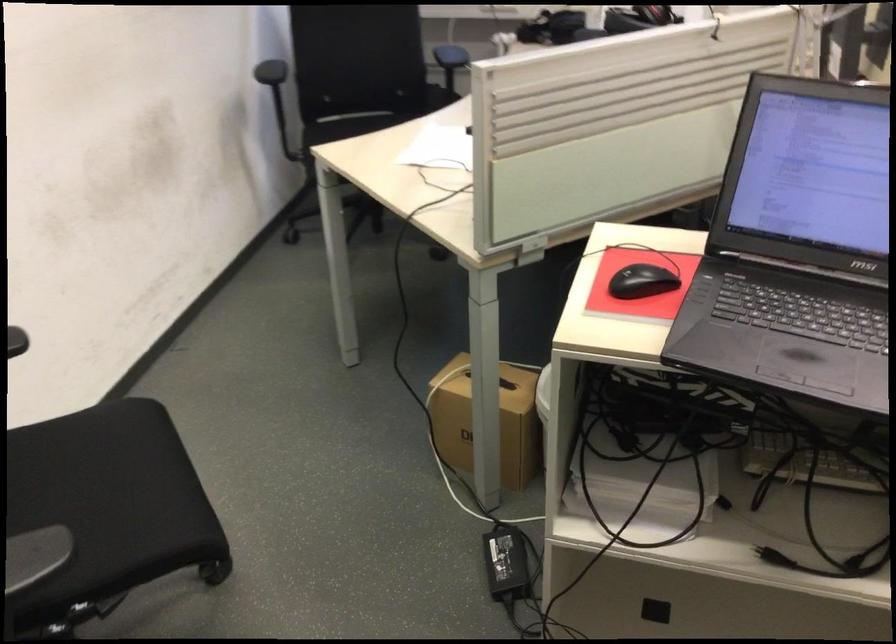
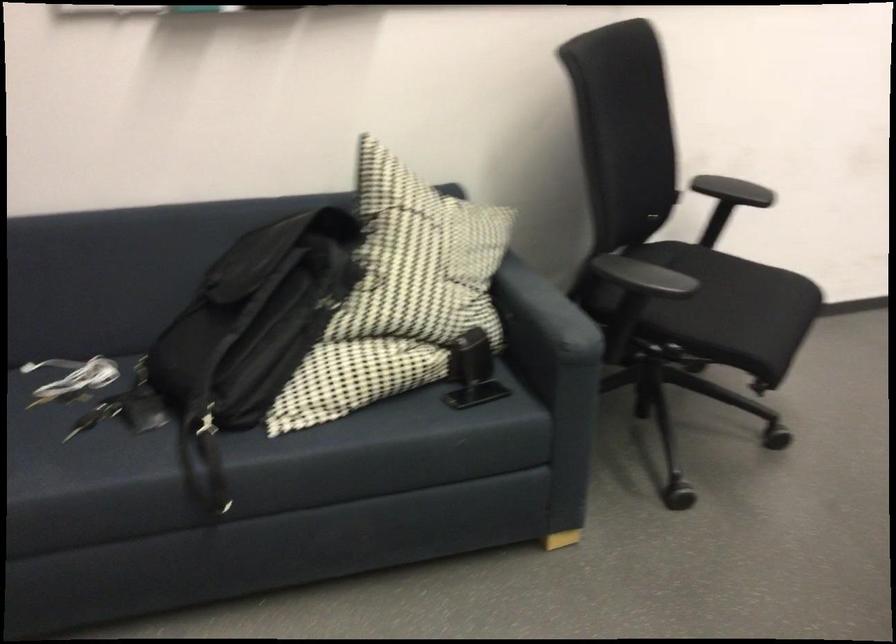
The first image is from the beginning of the video and the second image is from the end. How did the camera likely rotate when shooting the video?

The camera's rotation is toward left-down.